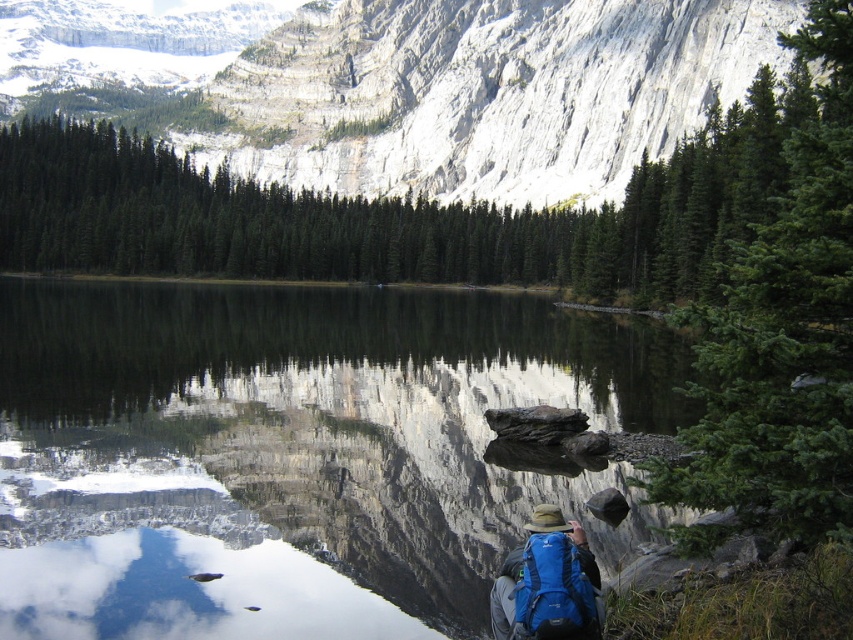
Question: Among these points, which one is nearest to the camera?

Choices:
 (A) (141, 484)
 (B) (505, 1)

Answer: (A)

Question: Which is farther from the smooth reflective water at center?

Choices:
 (A) white rocky mountain at upper center
 (B) blue fabric backpack at lower center

Answer: (A)

Question: Which of the following is the farthest from the observer?

Choices:
 (A) (x=688, y=369)
 (B) (x=524, y=566)
 (C) (x=670, y=80)

Answer: (C)

Question: Can you confirm if white rocky mountain at upper center is positioned above blue fabric backpack at lower center?

Choices:
 (A) yes
 (B) no

Answer: (A)

Question: Is smooth reflective water at center above blue fabric backpack at lower center?

Choices:
 (A) yes
 (B) no

Answer: (A)

Question: Can you confirm if white rocky mountain at upper center is thinner than blue fabric backpack at lower center?

Choices:
 (A) no
 (B) yes

Answer: (A)